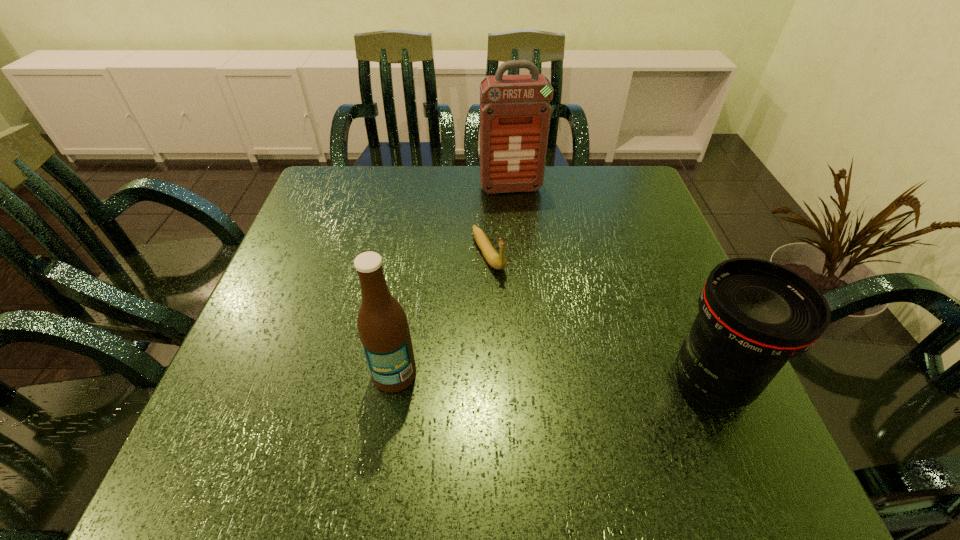
The height and width of the screenshot is (540, 960). I want to click on vacant area that lies between the first-aid kit and the third tallest object, so click(612, 285).

You are a GUI agent. You are given a task and a screenshot of the screen. Output one action in this format:
    pyautogui.click(x=<x>, y=<y>)
    Task: Click on the vacant region between the beer bottle and the second shortest object
    This screenshot has height=540, width=960.
    Given the screenshot: What is the action you would take?
    pyautogui.click(x=553, y=377)

I want to click on blank region between the farthest object and the telephoto lens, so click(612, 285).

Find the location of `vacant space that is in between the farthest object and the banana`. vacant space that is in between the farthest object and the banana is located at coordinates (499, 221).

At what (x,y) coordinates should I click in order to perform the action: click on empty location between the farthest object and the leftmost object. Please return your answer as a coordinate pair (x, y). Image resolution: width=960 pixels, height=540 pixels. Looking at the image, I should click on (452, 281).

Where is `vacant space that is in between the third tallest object and the banana`? Image resolution: width=960 pixels, height=540 pixels. vacant space that is in between the third tallest object and the banana is located at coordinates (600, 318).

The width and height of the screenshot is (960, 540). I want to click on blank region between the first-aid kit and the telephoto lens, so click(x=612, y=285).

Identify which object is the third nearest to the farthest object. Please provide its 2D coordinates. Your answer should be formatted as a tuple, i.e. [(x, y)], where the tuple contains the x and y coordinates of a point satisfying the conditions above.

[(382, 324)]

This screenshot has width=960, height=540. What are the coordinates of `object that is the closest to the third shortest object` in the screenshot? It's located at (496, 261).

The image size is (960, 540). I want to click on free space that satisfies the following two spatial constraints: 1. on the front side of the telephoto lens; 2. on the left side of the tallest object, so click(x=527, y=381).